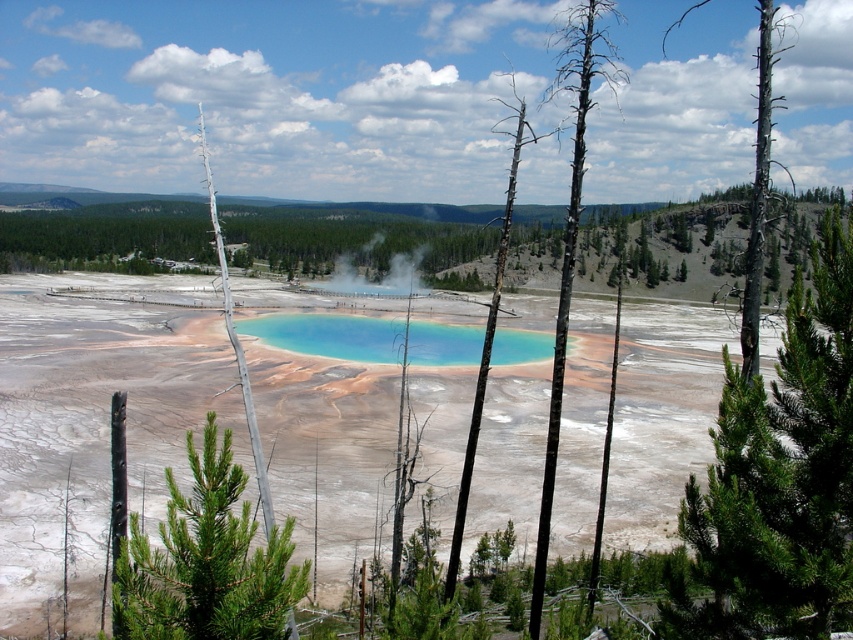
Question: Is green needle-like tree at center-right to the left of charred wood tree at center from the viewer's perspective?

Choices:
 (A) no
 (B) yes

Answer: (B)

Question: Can you confirm if turquoise glass pool at center is wider than charred wood tree trunk at upper right?

Choices:
 (A) no
 (B) yes

Answer: (A)

Question: Which of the following is the closest to the observer?

Choices:
 (A) charred wood tree trunk at upper right
 (B) charred wood tree at center
 (C) turquoise glass pool at center
 (D) green needle-like tree at center-right

Answer: (D)

Question: Estimate the real-world distances between objects in this image. Which object is farther from the charred wood tree trunk at upper right?

Choices:
 (A) green needle-like tree at lower left
 (B) charred wood tree at center
 (C) black bark tree at center

Answer: (A)

Question: Can you confirm if green needle-like tree at center-right is smaller than green needle-like tree at lower left?

Choices:
 (A) yes
 (B) no

Answer: (B)

Question: Which point is closer to the camera taking this photo?

Choices:
 (A) (833, 627)
 (B) (756, 310)
 (C) (577, 17)
 (D) (521, 348)

Answer: (A)